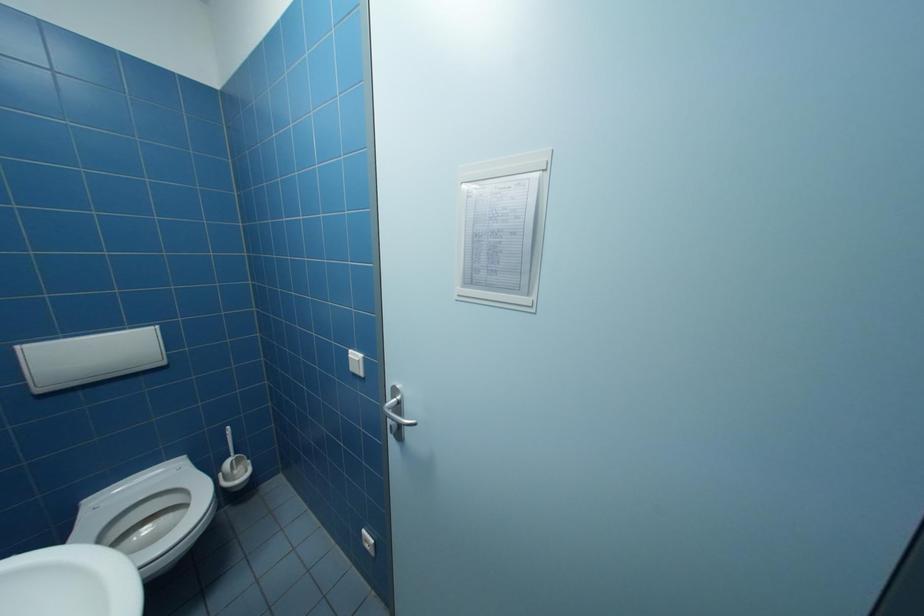
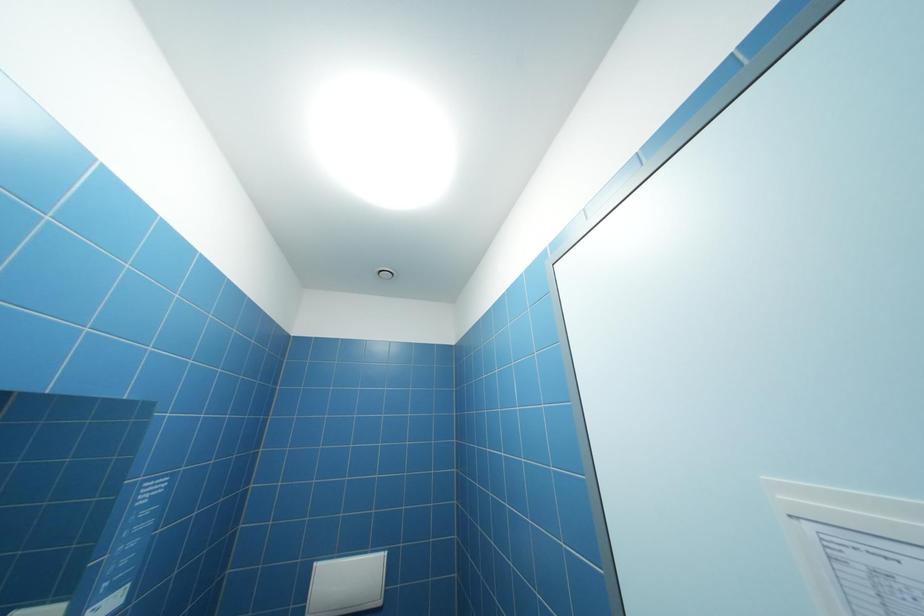
The first image is from the beginning of the video and the second image is from the end. How did the camera likely rotate when shooting the video?

The camera rotated toward left-up.